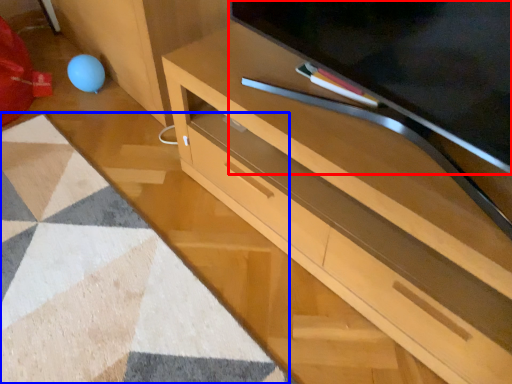
Question: Which object is closer to the camera taking this photo, television (highlighted by a red box) or mat (highlighted by a blue box)?

Choices:
 (A) television
 (B) mat

Answer: (A)